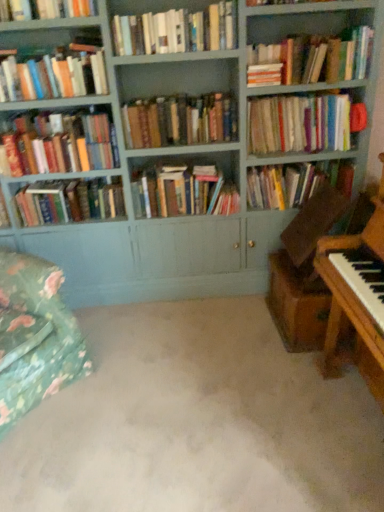
Question: In terms of size, does hardcover book at upper left, arranged as the 2th book when viewed from the left, appear bigger or smaller than green floral fabric swivel chair at lower left?

Choices:
 (A) small
 (B) big

Answer: (A)

Question: Is hardcover book at upper left, acting as the 9th book starting from the right, situated inside green floral fabric swivel chair at lower left or outside?

Choices:
 (A) inside
 (B) outside

Answer: (B)

Question: Considering the real-world distances, which object is farthest from the matte hardcover book at left, the 4th book positioned from the left?

Choices:
 (A) hardcover books at upper right, which is the second book from right to left
 (B) hardcover books at center, the 6th book when ordered from left to right
 (C) wooden piano at right
 (D) hardcover books at left, which is the 8th book in right-to-left order
 (E) hardcover books at upper left, the tenth book positioned from the right

Answer: (C)

Question: Which is nearer to the carpet at center?

Choices:
 (A) hardcover books at upper left, arranged as the first book when viewed from the left
 (B) hardcover book at upper left, acting as the 9th book starting from the right
 (C) green floral fabric swivel chair at lower left
 (D) hardcover books at center, the 7th book when ordered from left to right
 (E) hardcover books at upper center, arranged as the fifth book when viewed from the left

Answer: (C)